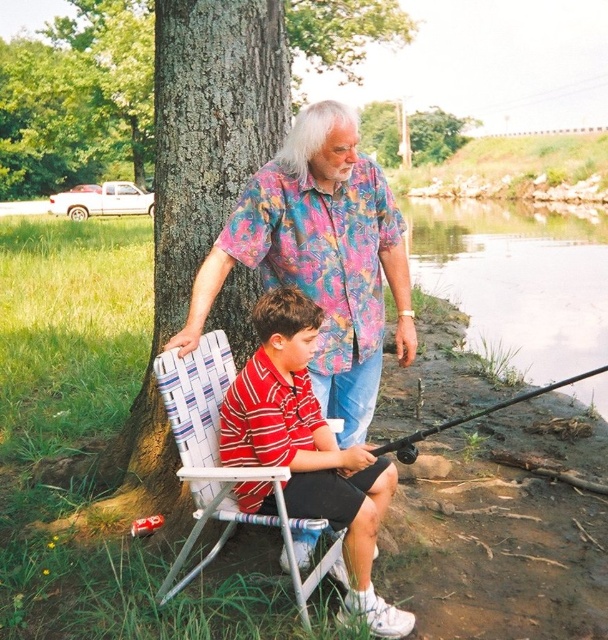
Can you confirm if striped cotton shirt at center is smaller than green textured tree at center?

No.

The height and width of the screenshot is (640, 608). Find the location of `striped cotton shirt at center`. striped cotton shirt at center is located at coordinates (308, 449).

Does green textured tree trunk at center have a greater height compared to striped cotton shirt at center?

Yes.

Does point (173, 104) come in front of point (255, 496)?

No, (173, 104) is behind (255, 496).

Between point (171, 499) and point (237, 396), which one is positioned behind?

The point (171, 499) is more distant.

Find the location of `green textured tree trunk at center`. green textured tree trunk at center is located at coordinates 215,168.

Does white woven folding chair at center appear on the left side of black matte fishing pole at lower right?

Yes, white woven folding chair at center is to the left of black matte fishing pole at lower right.

Who is lower down, white woven folding chair at center or black matte fishing pole at lower right?

white woven folding chair at center is lower down.

Measure the distance between white woven folding chair at center and camera.

The distance of white woven folding chair at center from camera is 2.53 meters.

You are a GUI agent. You are given a task and a screenshot of the screen. Output one action in this format:
    pyautogui.click(x=<x>, y=<y>)
    Task: Click on the white woven folding chair at center
    
    Given the screenshot: What is the action you would take?
    pyautogui.click(x=212, y=452)